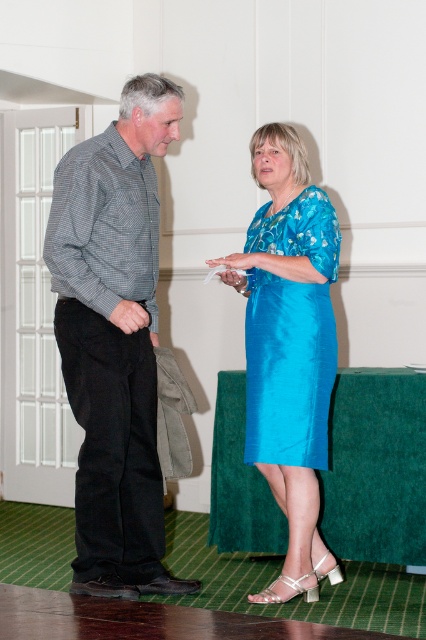
In the scene shown: Which is above, checkered fabric shirt at left or turquoise silk dress at center?

turquoise silk dress at center is above.

Who is more distant from viewer, [66,316] or [305,332]?

Positioned behind is point [305,332].

Identify the location of checkered fabric shirt at left. This screenshot has height=640, width=426. (114, 340).

Between turquoise silk dress at center and matte blue dress at center, which one has more height?

With more height is turquoise silk dress at center.

Who is positioned more to the left, turquoise silk dress at center or matte blue dress at center?

Positioned to the left is matte blue dress at center.

At what (x,y) coordinates should I click in order to perform the action: click on turquoise silk dress at center. Please return your answer as a coordinate pair (x, y). Image resolution: width=426 pixels, height=640 pixels. Looking at the image, I should click on [290, 336].

Who is more distant from viewer, (x=86, y=326) or (x=253, y=360)?

The point (x=253, y=360) is more distant.

Does checkered fabric shirt at left have a lesser height compared to shiny blue dress at center?

In fact, checkered fabric shirt at left may be taller than shiny blue dress at center.

What are the coordinates of `checkered fabric shirt at left` in the screenshot? It's located at (114, 340).